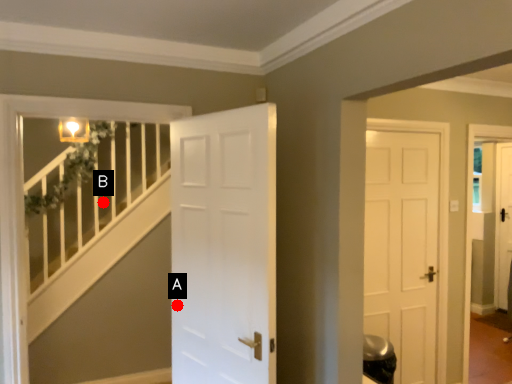
Question: Two points are circled on the image, labeled by A and B beside each circle. Which of the following is the farthest from the observer?

Choices:
 (A) A is further
 (B) B is further

Answer: (B)